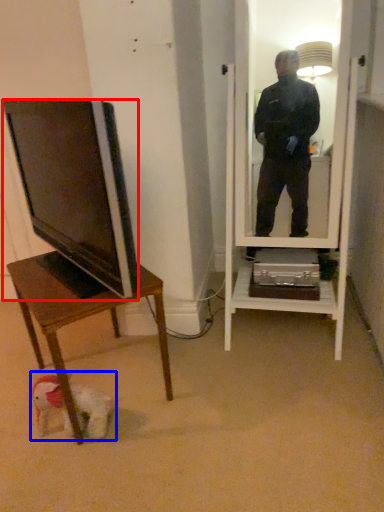
Question: Which object is closer to the camera taking this photo, television (highlighted by a red box) or dog (highlighted by a blue box)?

Choices:
 (A) television
 (B) dog

Answer: (A)